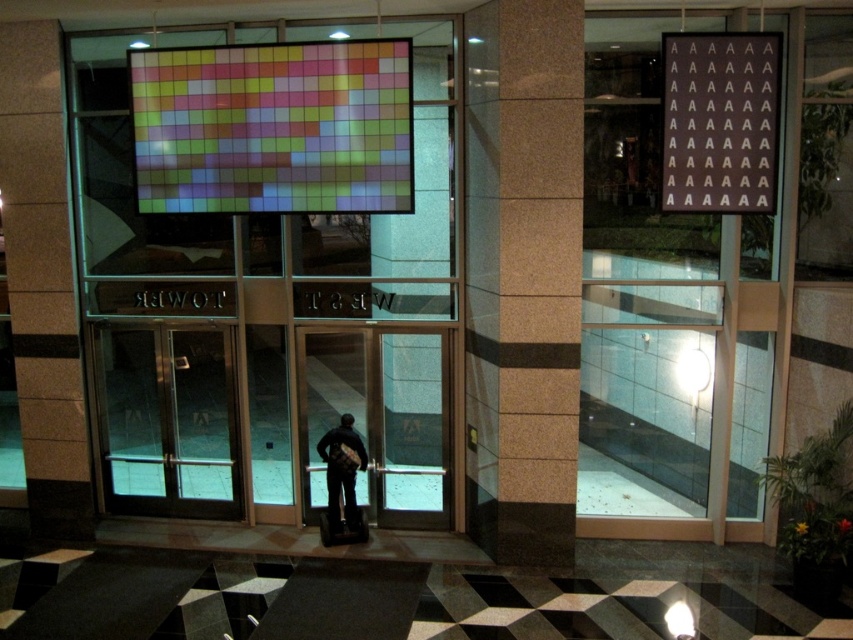
Question: Can you confirm if transparent glass door at center is positioned to the left of dark gray fabric jacket at center?

Choices:
 (A) yes
 (B) no

Answer: (A)

Question: Which of the following is the farthest from the observer?

Choices:
 (A) transparent glass door at center
 (B) dark gray fabric jacket at center
 (C) translucent glass elevator at center

Answer: (A)

Question: Which point is closer to the camera?

Choices:
 (A) dark gray fabric jacket at center
 (B) translucent glass elevator at center
 (C) brown polished stone pillar at center

Answer: (C)

Question: Considering the relative positions of multicolored pixelated display at center and dark gray fabric jacket at center in the image provided, where is multicolored pixelated display at center located with respect to dark gray fabric jacket at center?

Choices:
 (A) below
 (B) above

Answer: (B)

Question: Which object appears farthest from the camera in this image?

Choices:
 (A) transparent glass door at center
 (B) brown polished stone pillar at center
 (C) dark gray fabric jacket at center

Answer: (A)

Question: Does translucent glass elevator at center appear on the left side of transparent glass door at center?

Choices:
 (A) yes
 (B) no

Answer: (B)